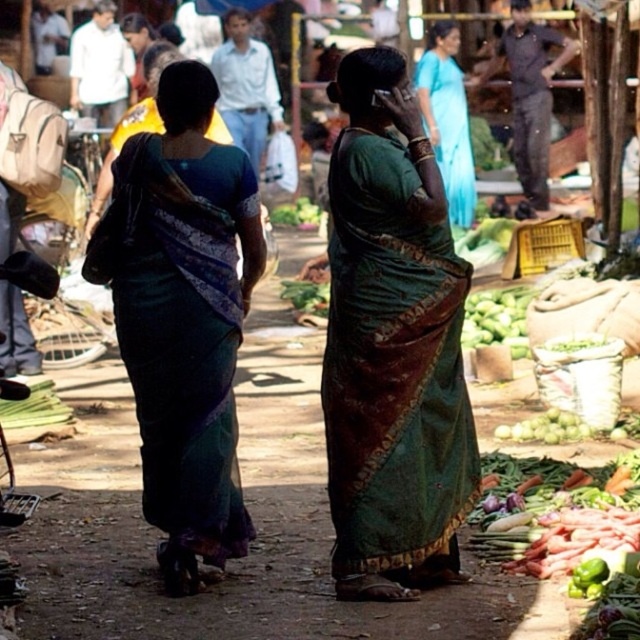
Question: Does dark green silk saree at center have a lesser width compared to green leafy vegetable at center?

Choices:
 (A) no
 (B) yes

Answer: (A)

Question: Can you confirm if green silk saree at center is positioned to the left of green leafy vegetable at center?

Choices:
 (A) yes
 (B) no

Answer: (B)

Question: Among these points, which one is nearest to the camera?

Choices:
 (A) (435, 342)
 (B) (448, 129)

Answer: (A)

Question: Based on their relative distances, which object is nearer to the green matte cucumber at center?

Choices:
 (A) blue silk saree at center
 (B) dark green silk saree at center

Answer: (A)

Question: Which of the following is the farthest from the observer?

Choices:
 (A) green matte cucumber at center
 (B) green silk saree at center
 (C) green leafy vegetable at center

Answer: (C)

Question: Where is dark green silk saree at center located in relation to green leafy vegetable at center in the image?

Choices:
 (A) right
 (B) left

Answer: (B)